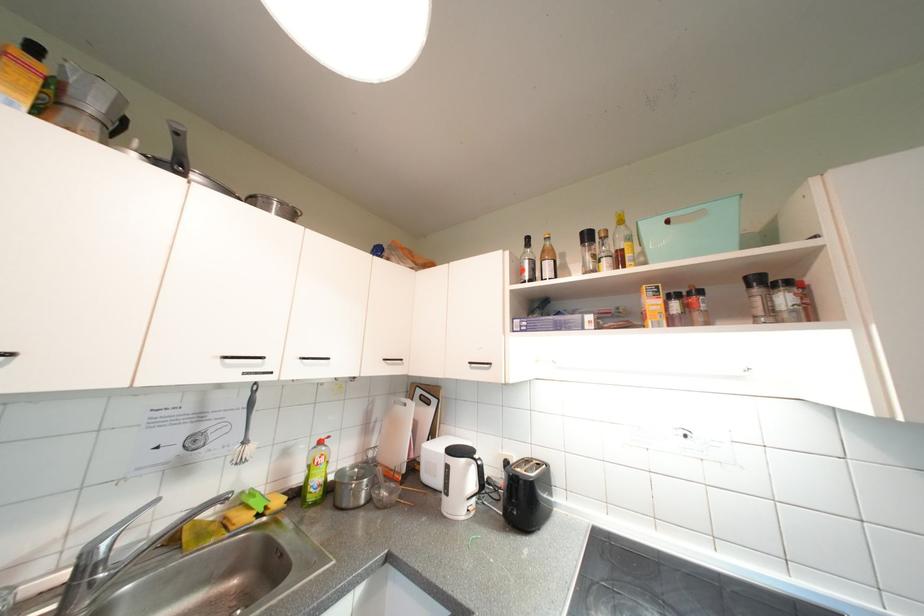
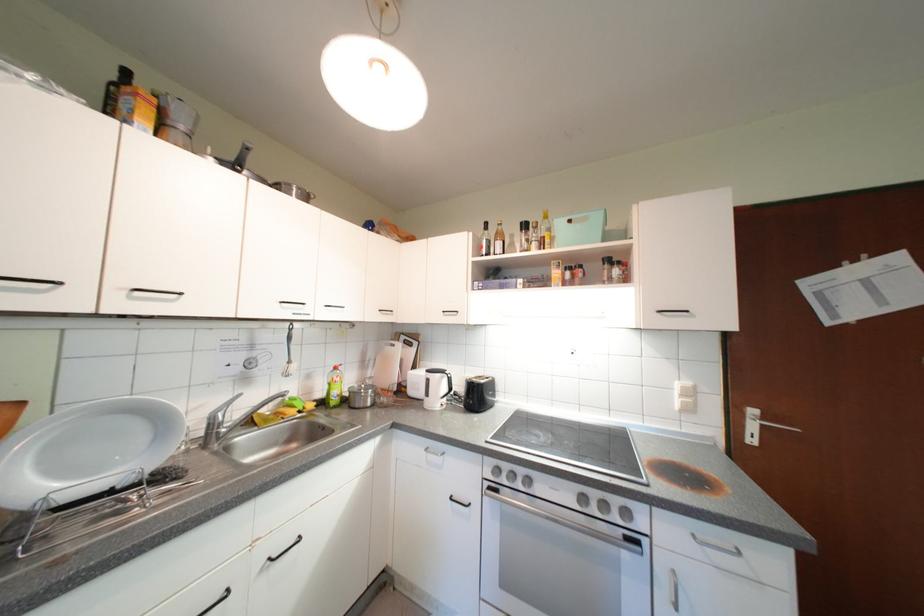
The point at (x=470, y=463) is marked in the first image. Where is the corresponding point in the second image?

(446, 378)